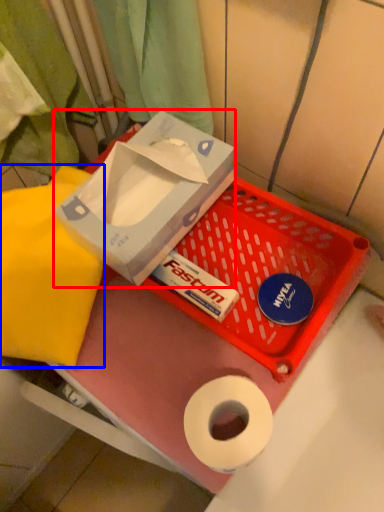
Question: Which point is closer to the camera, box (highlighted by a red box) or cloth (highlighted by a blue box)?

Choices:
 (A) box
 (B) cloth

Answer: (A)